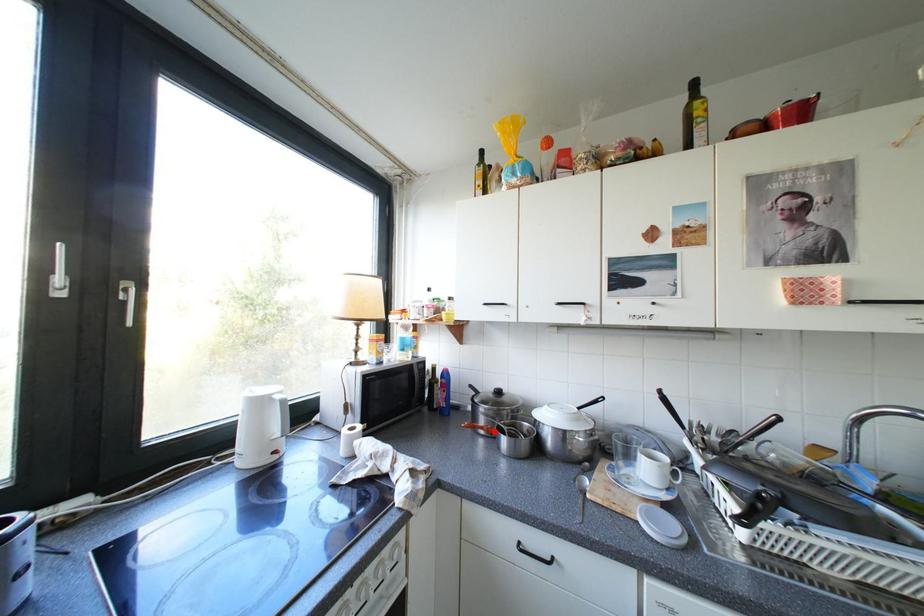
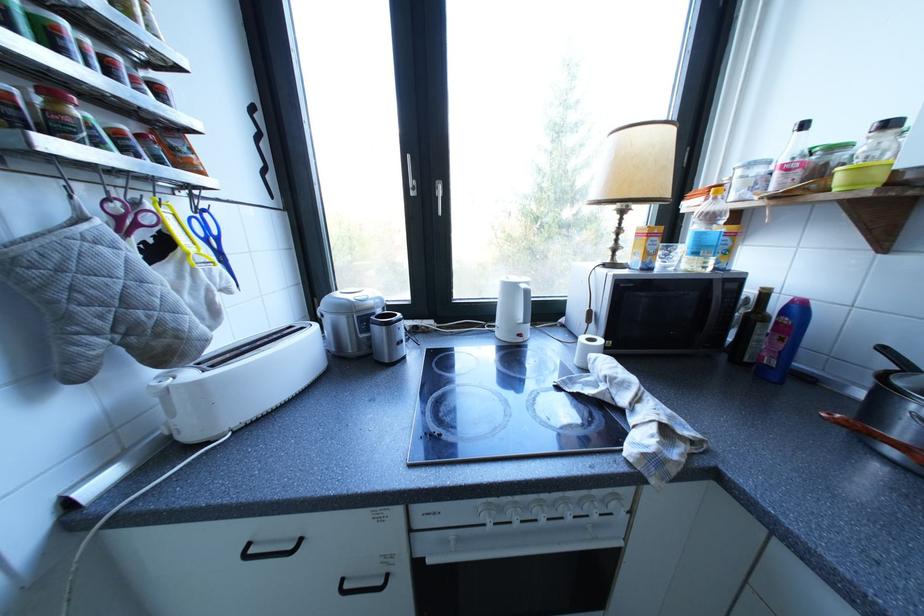
The point at the highlighted location is marked in the first image. Where is the corresponding point in the second image?

(907, 454)